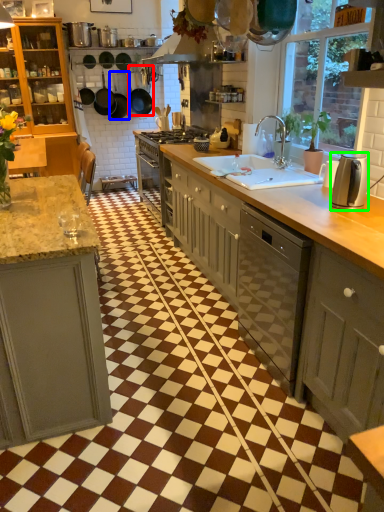
Question: Considering the real-world distances, which object is farthest from frying pan (highlighted by a red box)? frying pan (highlighted by a blue box) or kitchen appliance (highlighted by a green box)?

Choices:
 (A) frying pan
 (B) kitchen appliance

Answer: (B)